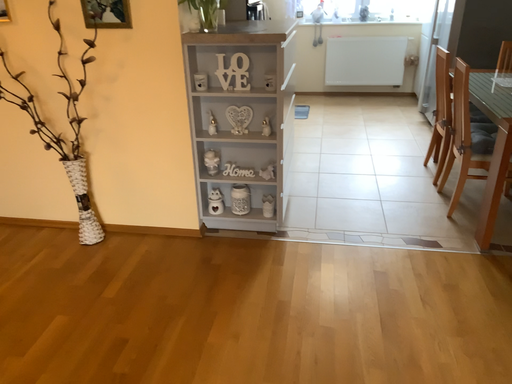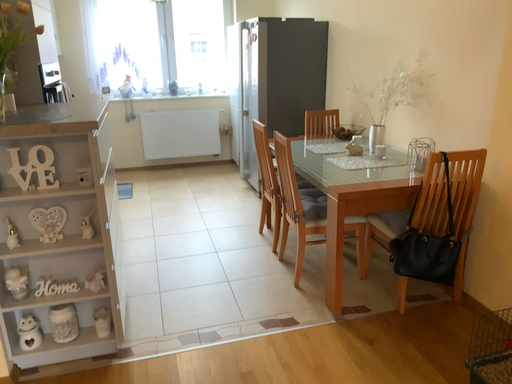
Question: Which way did the camera rotate in the video?

Choices:
 (A) rotated downward
 (B) rotated upward

Answer: (B)